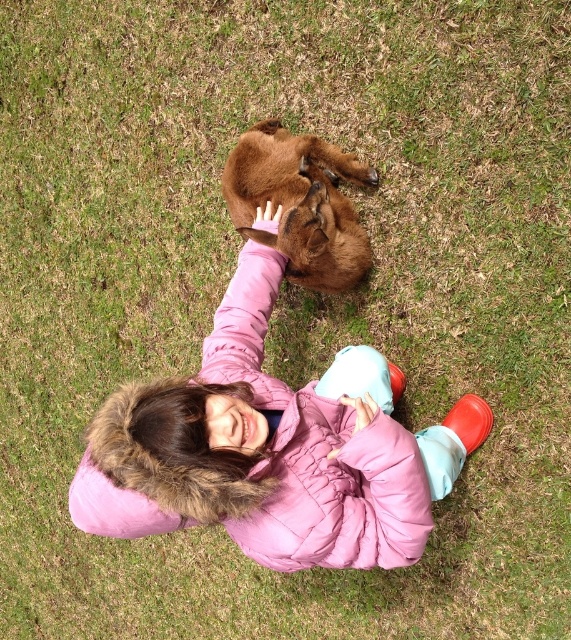
Who is more forward, (303,412) or (264,241)?

Point (303,412) is more forward.

How far apart are pink quilted jacket at center and brown furry dog at center?

The distance of pink quilted jacket at center from brown furry dog at center is 20.03 inches.

Based on the photo, measure the distance between point (264,522) and camera.

Point (264,522) is 6.30 feet from camera.

Find the location of `pink quilted jacket at center`. pink quilted jacket at center is located at coordinates (271, 451).